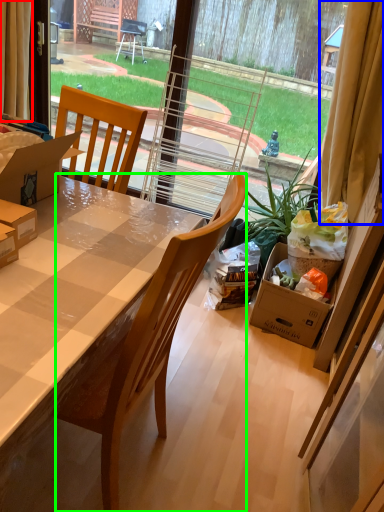
Question: Which object is the closest to the curtain (highlighted by a red box)? Choose among these: curtain (highlighted by a blue box) or chair (highlighted by a green box).

Choices:
 (A) curtain
 (B) chair

Answer: (B)